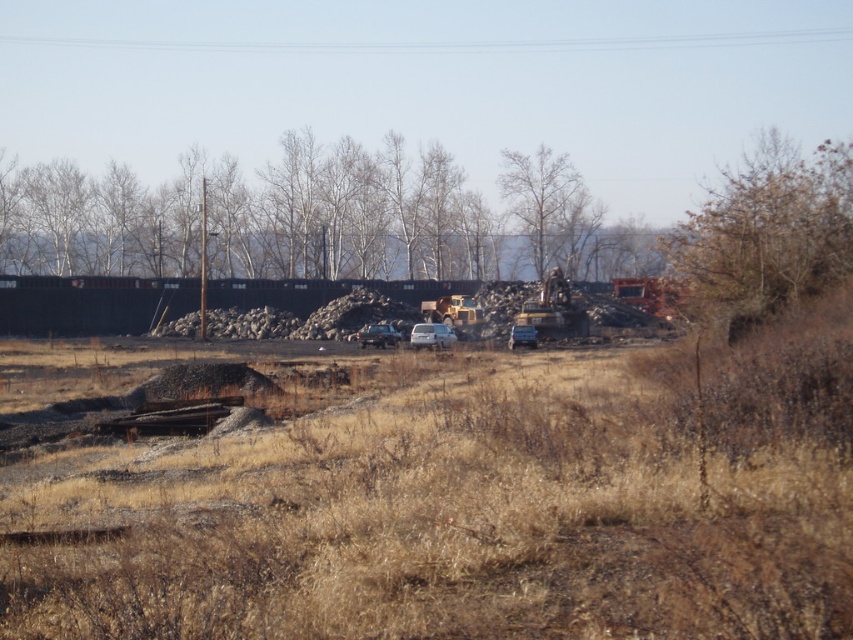
You are a drone operator trying to capture a photo of two specific points in the construction site. The first point is labeled as point (103, 252) and the second is point (416, 339). Since you want to ensure both points are clearly visible in the photo, which point should you focus on first to maintain clarity?

You should focus on point (103, 252) first because it is closer to the camera than point (416, 339). This ensures that the closer point remains in focus while adjusting for the farther one.

You are standing at the entrance of the construction site and notice the bare branches at center. Can you determine their exact position relative to the center of the image?

The bare branches at center are exactly at the center of the image, located at coordinates point (315, 218).